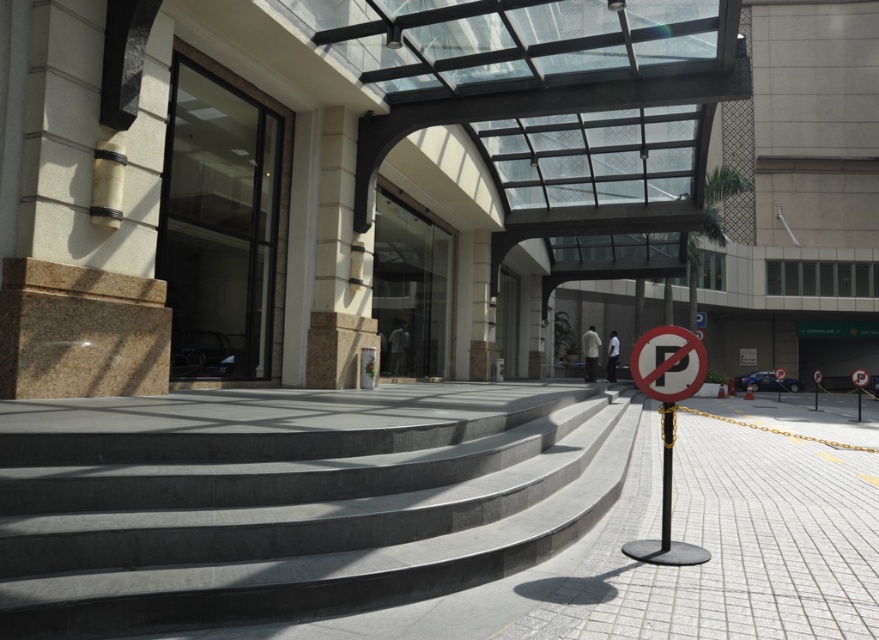
Does gray concrete stairs at center have a greater height compared to white plastic sign at center?

Yes, gray concrete stairs at center is taller than white plastic sign at center.

Between point (13, 401) and point (672, 442), which one is positioned in front?

Point (672, 442) is in front.

Locate an element on the screen. The height and width of the screenshot is (640, 879). gray concrete stairs at center is located at coordinates (289, 499).

Is white plastic sign at center taller than black metal pole at center?

No, white plastic sign at center is not taller than black metal pole at center.

Is white plastic sign at center positioned before black metal pole at center?

Yes, white plastic sign at center is in front of black metal pole at center.

Identify the location of white plastic sign at center. (667, 424).

Based on the photo, which is more to the right, white tile pavement at center or black metal pole at center?

From the viewer's perspective, white tile pavement at center appears more on the right side.

Which is above, white tile pavement at center or black metal pole at center?

black metal pole at center is higher up.

Does point (746, 444) lie behind point (662, 483)?

That is True.

Locate an element on the screen. This screenshot has width=879, height=640. white tile pavement at center is located at coordinates (729, 544).